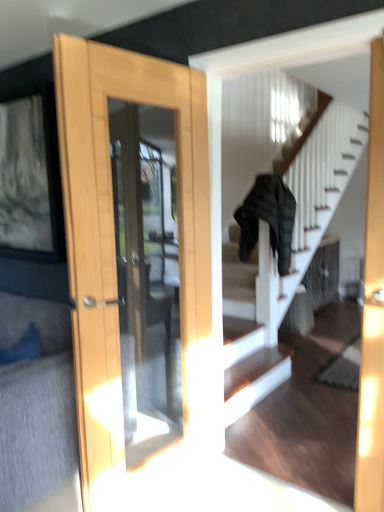
Question: Does point (14, 483) appear closer or farther from the camera than point (251, 236)?

Choices:
 (A) closer
 (B) farther

Answer: (A)

Question: In terms of size, does textured gray couch at lower left appear bigger or smaller than black fabric jacket at center?

Choices:
 (A) big
 (B) small

Answer: (B)

Question: Is textured gray couch at lower left in front of or behind black fabric jacket at center in the image?

Choices:
 (A) behind
 (B) front

Answer: (B)

Question: Choose the correct answer: Is black fabric jacket at center inside textured gray couch at lower left or outside it?

Choices:
 (A) outside
 (B) inside

Answer: (A)

Question: Considering their positions, is black fabric jacket at center located in front of or behind textured gray couch at lower left?

Choices:
 (A) behind
 (B) front

Answer: (A)

Question: Visually, is black fabric jacket at center positioned to the left or to the right of textured gray couch at lower left?

Choices:
 (A) right
 (B) left

Answer: (A)

Question: Is point (241, 226) closer or farther from the camera than point (26, 492)?

Choices:
 (A) farther
 (B) closer

Answer: (A)